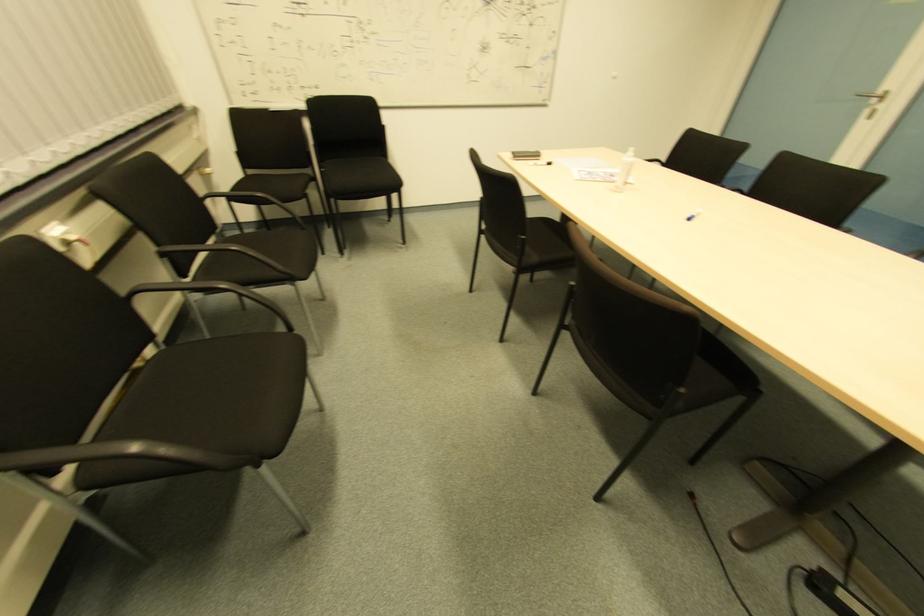
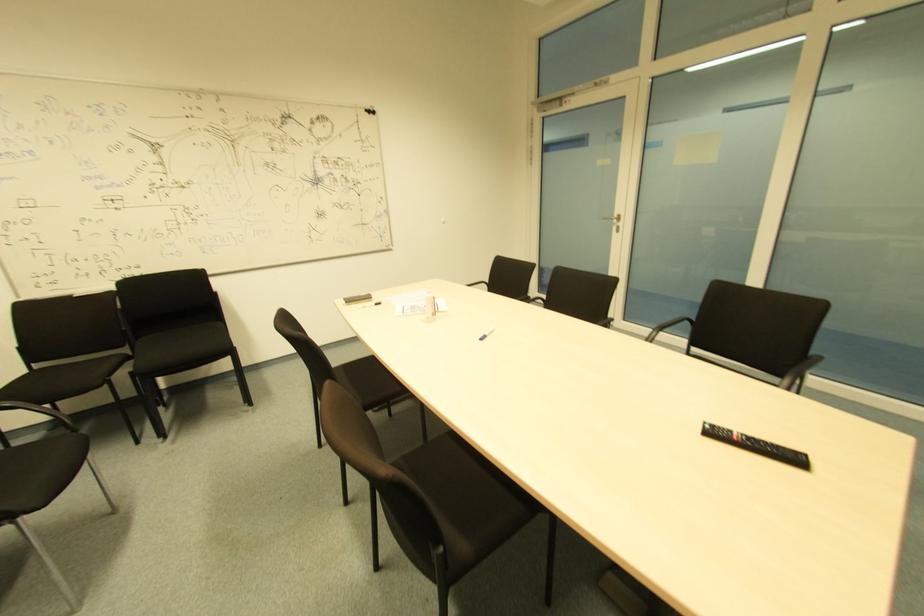
Locate, in the second image, the point that corresponds to (249,176) in the first image.

(34, 370)